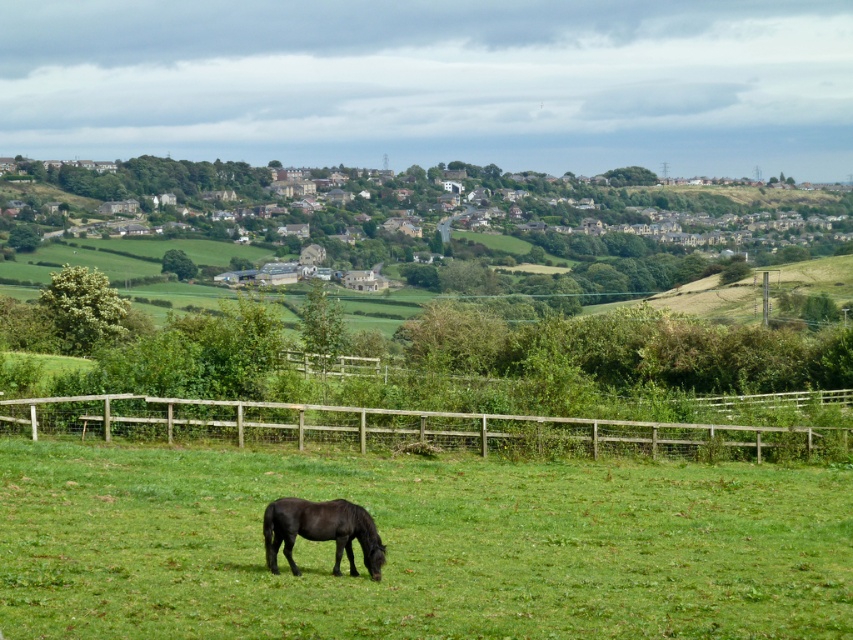
Consider the image. Is green grassy field at center smaller than brown wooden fence at lower center?

Yes.

Does point (209, 484) lie in front of point (378, 436)?

Yes, point (209, 484) is in front of point (378, 436).

Between point (80, 448) and point (708, 442), which one is positioned behind?

Point (708, 442)

Image resolution: width=853 pixels, height=640 pixels. What are the coordinates of `green grassy field at center` in the screenshot? It's located at (419, 545).

Who is positioned more to the right, brown wooden fence at lower center or black glossy horse at lower center?

Positioned to the right is brown wooden fence at lower center.

Is point (175, 433) farther from viewer compared to point (364, 564)?

Yes, point (175, 433) is behind point (364, 564).

This screenshot has height=640, width=853. What are the coordinates of `brown wooden fence at lower center` in the screenshot? It's located at (405, 428).

Consider the image. Measure the distance between green grassy field at center and black glossy horse at lower center.

green grassy field at center is 28.02 feet away from black glossy horse at lower center.

Who is more distant from viewer, [344,490] or [321,525]?

Point [344,490]

Is point (396, 609) closer to camera compared to point (367, 538)?

Yes.

Find the location of a particular element. The height and width of the screenshot is (640, 853). green grassy field at center is located at coordinates (419, 545).